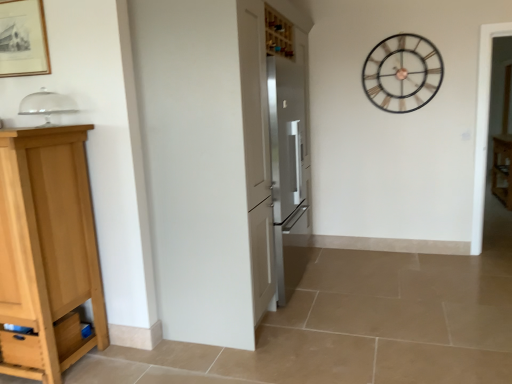
Where is `wooden cabinet at right, which ranks as the 2th cabinetry in left-to-right order`? Image resolution: width=512 pixels, height=384 pixels. wooden cabinet at right, which ranks as the 2th cabinetry in left-to-right order is located at coordinates (502, 168).

Find the location of a particular element. Image resolution: width=512 pixels, height=384 pixels. wooden cabinet at right, placed as the first cabinetry when sorted from back to front is located at coordinates (502, 168).

From the image's perspective, is metallic gold clock at upper right located above or below wooden picture frame at upper left?

From the image's perspective, metallic gold clock at upper right appears above wooden picture frame at upper left.

Based on the photo, between metallic gold clock at upper right and wooden picture frame at upper left, which one has larger width?

Wider between the two is metallic gold clock at upper right.

Which object is further away from the camera, metallic gold clock at upper right or wooden picture frame at upper left?

metallic gold clock at upper right is more distant.

Which is more to the right, metallic gold clock at upper right or wooden picture frame at upper left?

metallic gold clock at upper right.

Find the location of a particular element. The width and height of the screenshot is (512, 384). the 1st cabinetry positioned below the wooden picture frame at upper left (from the image's perspective) is located at coordinates (502, 168).

From a real-world perspective, is wooden picture frame at upper left located higher than wooden cabinet at right, the first cabinetry when ordered from right to left?

Yes, from a real-world perspective, wooden picture frame at upper left is above wooden cabinet at right, the first cabinetry when ordered from right to left.

Considering the relative positions of wooden picture frame at upper left and wooden cabinet at right, which ranks as the 2th cabinetry in left-to-right order, in the image provided, is wooden picture frame at upper left to the left of wooden cabinet at right, which ranks as the 2th cabinetry in left-to-right order, from the viewer's perspective?

Indeed, wooden picture frame at upper left is positioned on the left side of wooden cabinet at right, which ranks as the 2th cabinetry in left-to-right order.

Locate an element on the screen. picture frame lying above the clear glass dome at upper left, acting as the 1th appliance starting from the left (from the image's perspective) is located at coordinates (23, 39).

Is clear glass dome at upper left, marked as the 1th appliance in a top-to-bottom arrangement, outside of wooden picture frame at upper left?

Yes, clear glass dome at upper left, marked as the 1th appliance in a top-to-bottom arrangement, is located beyond the bounds of wooden picture frame at upper left.

From the image's perspective, is clear glass dome at upper left, the 2th appliance in the back-to-front sequence, on top of wooden picture frame at upper left?

No.

From a real-world perspective, does clear glass dome at upper left, arranged as the second appliance when ordered from the bottom, sit lower than wooden picture frame at upper left?

Yes, from a real-world perspective, clear glass dome at upper left, arranged as the second appliance when ordered from the bottom, is under wooden picture frame at upper left.

Does wooden picture frame at upper left lie behind satin silver refrigerator at center, acting as the 1th appliance starting from the back?

No, wooden picture frame at upper left is closer to the viewer.

Does wooden picture frame at upper left have a greater width compared to satin silver refrigerator at center, which is the second appliance from top to bottom?

In fact, wooden picture frame at upper left might be narrower than satin silver refrigerator at center, which is the second appliance from top to bottom.

From the picture: From the image's perspective, which one is positioned higher, wooden picture frame at upper left or satin silver refrigerator at center, which is the second appliance from top to bottom?

From the image's view, wooden picture frame at upper left is above.

Is wooden picture frame at upper left bigger or smaller than satin silver refrigerator at center, the second appliance in the left-to-right sequence?

Clearly, wooden picture frame at upper left is smaller in size than satin silver refrigerator at center, the second appliance in the left-to-right sequence.

Can you tell me how much metallic gold clock at upper right and wooden cabinet at right, which ranks as the 2th cabinetry in left-to-right order, differ in facing direction?

There is a 90.6-degree angle between the facing directions of metallic gold clock at upper right and wooden cabinet at right, which ranks as the 2th cabinetry in left-to-right order.

Considering the relative sizes of metallic gold clock at upper right and wooden cabinet at right, which is the 2th cabinetry in front-to-back order, in the image provided, is metallic gold clock at upper right wider than wooden cabinet at right, which is the 2th cabinetry in front-to-back order,?

Incorrect, the width of metallic gold clock at upper right does not surpass that of wooden cabinet at right, which is the 2th cabinetry in front-to-back order.

Which object is positioned more to the left, metallic gold clock at upper right or wooden cabinet at right, which ranks as the 2th cabinetry in left-to-right order?

metallic gold clock at upper right is more to the left.

From the picture: Is metallic gold clock at upper right aimed at wooden cabinet at right, the first cabinetry when ordered from right to left?

No, metallic gold clock at upper right is not turned towards wooden cabinet at right, the first cabinetry when ordered from right to left.

Is wooden cabinet at right, which is the 2th cabinetry in front-to-back order, at the left side of light wood cabinet at left, the 1th cabinetry when ordered from front to back?

Incorrect, wooden cabinet at right, which is the 2th cabinetry in front-to-back order, is not on the left side of light wood cabinet at left, the 1th cabinetry when ordered from front to back.

Which is farther from the camera, (x=500, y=155) or (x=62, y=345)?

The point (x=500, y=155) is farther from the camera.

Find the location of a particular element. The image size is (512, 384). cabinetry above the light wood cabinet at left, the second cabinetry when ordered from back to front (from the image's perspective) is located at coordinates tap(502, 168).

Is wooden cabinet at right, the first cabinetry when ordered from right to left, turned away from light wood cabinet at left, the second cabinetry when ordered from back to front?

No.

How different are the orientations of wooden cabinet at right, which is the 2th cabinetry in front-to-back order, and clear glass dome at upper left, the 1th appliance when ordered from front to back, in degrees?

The facing directions of wooden cabinet at right, which is the 2th cabinetry in front-to-back order, and clear glass dome at upper left, the 1th appliance when ordered from front to back, are 92 degrees apart.

Looking at this image, considering the sizes of objects wooden cabinet at right, which ranks as the 2th cabinetry in left-to-right order, and clear glass dome at upper left, the second appliance when ordered from right to left, in the image provided, who is thinner, wooden cabinet at right, which ranks as the 2th cabinetry in left-to-right order, or clear glass dome at upper left, the second appliance when ordered from right to left,?

clear glass dome at upper left, the second appliance when ordered from right to left.

Would you say clear glass dome at upper left, the 2th appliance in the back-to-front sequence, is part of wooden cabinet at right, placed as the first cabinetry when sorted from back to front,'s contents?

No, clear glass dome at upper left, the 2th appliance in the back-to-front sequence, is located outside of wooden cabinet at right, placed as the first cabinetry when sorted from back to front.

From the image's perspective, which object appears higher, wooden cabinet at right, which ranks as the 2th cabinetry in left-to-right order, or clear glass dome at upper left, the 2th appliance in the back-to-front sequence?

clear glass dome at upper left, the 2th appliance in the back-to-front sequence, from the image's perspective.

At what (x,y) coordinates should I click in order to perform the action: click on picture frame in front of the metallic gold clock at upper right. Please return your answer as a coordinate pair (x, y). This screenshot has height=384, width=512. Looking at the image, I should click on (23, 39).

Locate an element on the screen. The image size is (512, 384). cabinetry that is the 2nd one below the wooden picture frame at upper left (from a real-world perspective) is located at coordinates (502, 168).

Looking at the image, which one is located further to wooden cabinet at right, which is the 2th cabinetry in front-to-back order, clear glass dome at upper left, the 1th appliance when ordered from front to back, or metallic gold clock at upper right?

Based on the image, clear glass dome at upper left, the 1th appliance when ordered from front to back, appears to be further to wooden cabinet at right, which is the 2th cabinetry in front-to-back order.

Looking at the image, which one is located further to wooden cabinet at right, which ranks as the 2th cabinetry in left-to-right order, satin silver refrigerator at center, positioned as the first appliance in bottom-to-top order, or clear glass dome at upper left, acting as the 1th appliance starting from the left?

clear glass dome at upper left, acting as the 1th appliance starting from the left, is further to wooden cabinet at right, which ranks as the 2th cabinetry in left-to-right order.

Estimate the real-world distances between objects in this image. Which object is further from light wood cabinet at left, the 1th cabinetry when ordered from front to back, satin silver refrigerator at center, positioned as the first appliance in bottom-to-top order, or wooden picture frame at upper left?

satin silver refrigerator at center, positioned as the first appliance in bottom-to-top order, is further to light wood cabinet at left, the 1th cabinetry when ordered from front to back.

Based on their spatial positions, is light wood cabinet at left, the first cabinetry in the left-to-right sequence, or satin silver refrigerator at center, acting as the 1th appliance starting from the back, closer to wooden cabinet at right, which ranks as the 2th cabinetry in left-to-right order?

satin silver refrigerator at center, acting as the 1th appliance starting from the back, is positioned closer to the anchor wooden cabinet at right, which ranks as the 2th cabinetry in left-to-right order.

Estimate the real-world distances between objects in this image. Which object is further from clear glass dome at upper left, the second appliance when ordered from right to left, light wood cabinet at left, the second cabinetry when ordered from back to front, or metallic gold clock at upper right?

Among the two, metallic gold clock at upper right is located further to clear glass dome at upper left, the second appliance when ordered from right to left.

Looking at the image, which one is located further to light wood cabinet at left, the 1th cabinetry when ordered from front to back, metallic gold clock at upper right or wooden cabinet at right, the first cabinetry when ordered from right to left?

wooden cabinet at right, the first cabinetry when ordered from right to left, lies further to light wood cabinet at left, the 1th cabinetry when ordered from front to back, than the other object.

From the image, which object appears to be nearer to light wood cabinet at left, the second cabinetry when ordered from back to front, wooden picture frame at upper left or clear glass dome at upper left, the 1th appliance when ordered from front to back?

clear glass dome at upper left, the 1th appliance when ordered from front to back.

When comparing their distances from wooden cabinet at right, which ranks as the 2th cabinetry in left-to-right order, does metallic gold clock at upper right or satin silver refrigerator at center, the 1th appliance from the right, seem closer?

Based on the image, metallic gold clock at upper right appears to be nearer to wooden cabinet at right, which ranks as the 2th cabinetry in left-to-right order.

Find the location of `wall clock between clear glass dome at upper left, the 2th appliance in the back-to-front sequence, and wooden cabinet at right, which is the 2th cabinetry in front-to-back order`. wall clock between clear glass dome at upper left, the 2th appliance in the back-to-front sequence, and wooden cabinet at right, which is the 2th cabinetry in front-to-back order is located at coordinates (402, 73).

You are a GUI agent. You are given a task and a screenshot of the screen. Output one action in this format:
    pyautogui.click(x=<x>, y=<y>)
    Task: Click on the wall clock between satin silver refrigerator at center, acting as the 1th appliance starting from the back, and wooden cabinet at right, placed as the first cabinetry when sorted from back to front
    The width and height of the screenshot is (512, 384).
    Given the screenshot: What is the action you would take?
    pyautogui.click(x=402, y=73)

Find the location of a particular element. appliance between wooden picture frame at upper left and satin silver refrigerator at center, the second appliance in the left-to-right sequence, from left to right is located at coordinates pyautogui.click(x=46, y=105).

Where is `picture frame situated between light wood cabinet at left, marked as the 2th cabinetry in a right-to-left arrangement, and wooden cabinet at right, which ranks as the 2th cabinetry in left-to-right order, from left to right`? The height and width of the screenshot is (384, 512). picture frame situated between light wood cabinet at left, marked as the 2th cabinetry in a right-to-left arrangement, and wooden cabinet at right, which ranks as the 2th cabinetry in left-to-right order, from left to right is located at coordinates (23, 39).